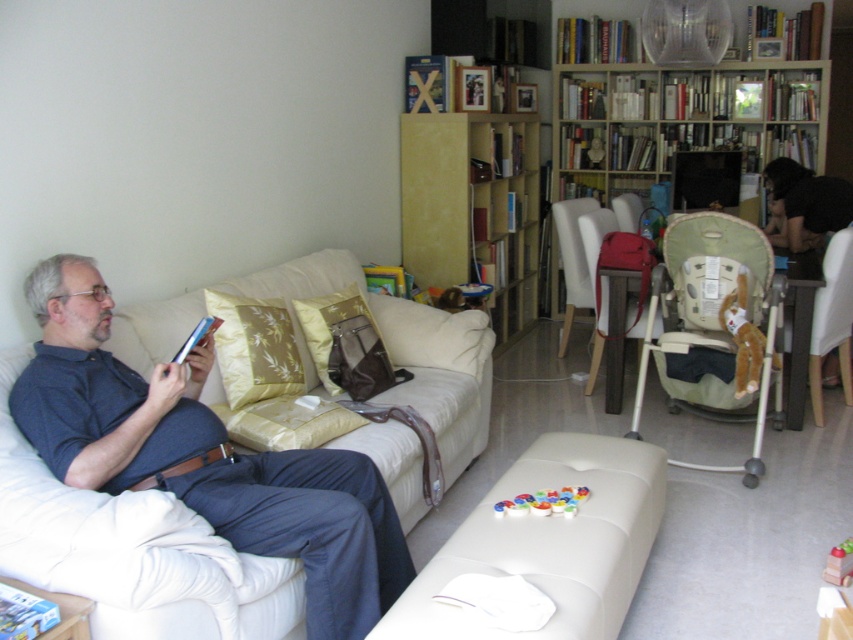
You are trying to place a new decorative item on the ottoman in front of the sofa. You have a gold fabric pillow at center and a white plastic chair at right. Which object should you choose to ensure it fits comfortably on the ottoman without overcrowding?

The gold fabric pillow at center might be wider than the white plastic chair at right, so the white plastic chair at right is more likely to fit comfortably on the ottoman without overcrowding.

You are a guest in the living room and want to pick up the gold textured pillow at center and the matte brown chair at center. Which object is easier to reach without moving from your current position?

The gold textured pillow at center is closer to the viewer than the matte brown chair at center, so it is easier to reach without moving.

You are a guest entering the living room and want to sit down. You see the beige fabric couch at left and the matte brown chair at center. Which one is closer to the entrance?

The beige fabric couch at left is closer to the entrance because it is positioned to the left of the matte brown chair at center, implying it is nearer to where you entered.